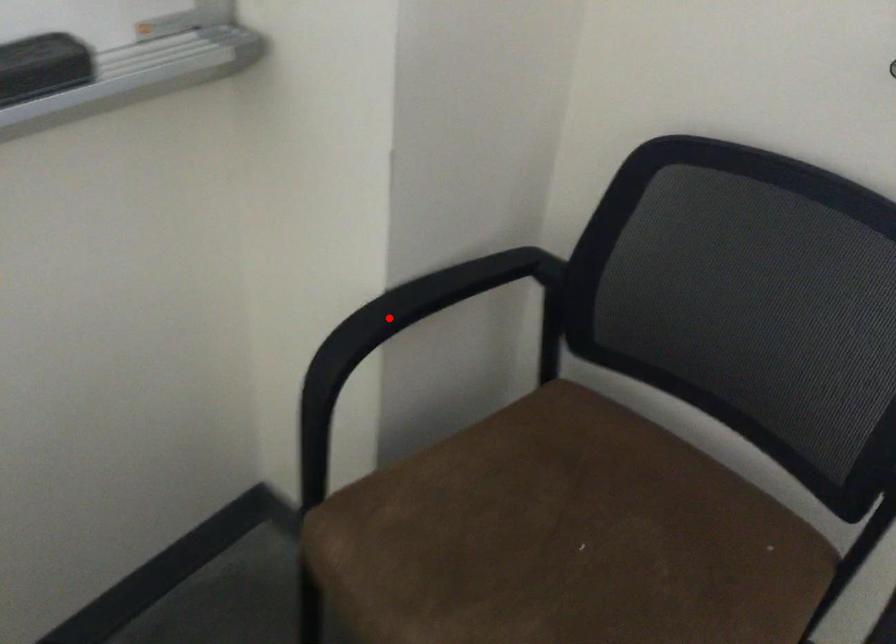
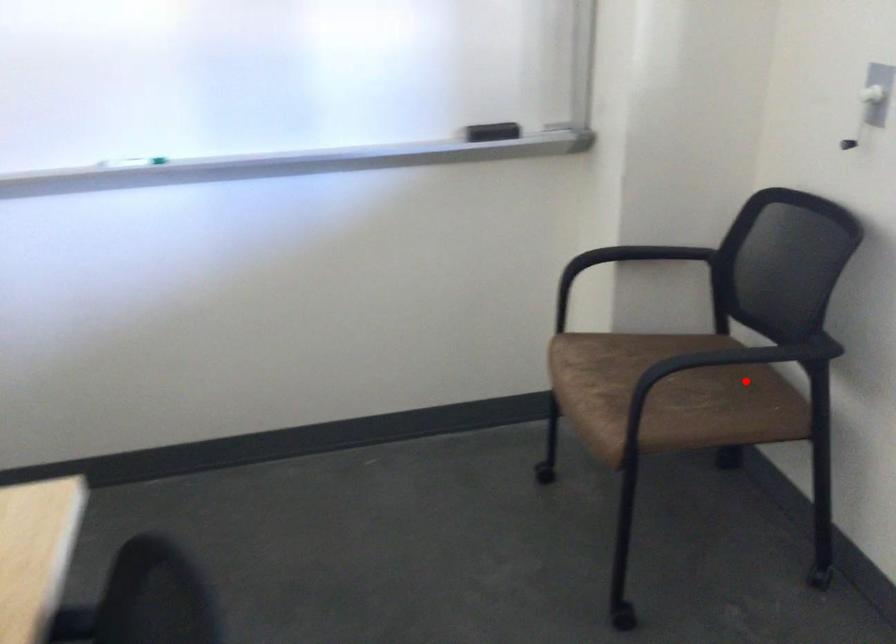
I am providing you with two images of the same scene from different viewpoints. A red point is marked on the first image and another point is marked on the second image. Is the red point in image1 aligned with the point shown in image2?

No